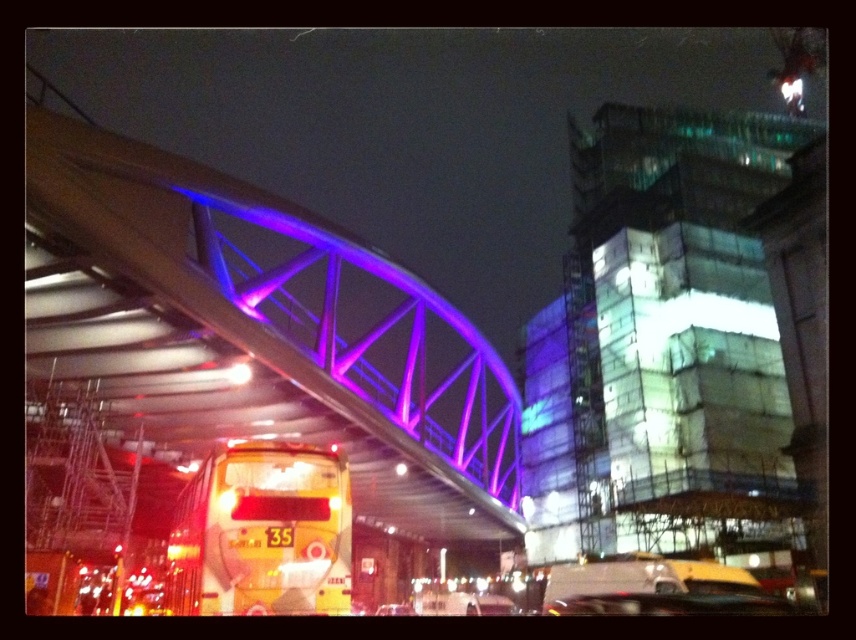
Can you confirm if metallic purple bridge at upper center is smaller than yellow matte/decorative bus at lower left?

Incorrect, metallic purple bridge at upper center is not smaller in size than yellow matte/decorative bus at lower left.

Who is shorter, metallic purple bridge at upper center or yellow matte/decorative bus at lower left?

With less height is yellow matte/decorative bus at lower left.

Locate an element on the screen. The image size is (856, 640). metallic purple bridge at upper center is located at coordinates tap(259, 330).

You are a GUI agent. You are given a task and a screenshot of the screen. Output one action in this format:
    pyautogui.click(x=<x>, y=<y>)
    Task: Click on the metallic purple bridge at upper center
    This screenshot has width=856, height=640.
    Given the screenshot: What is the action you would take?
    pyautogui.click(x=259, y=330)